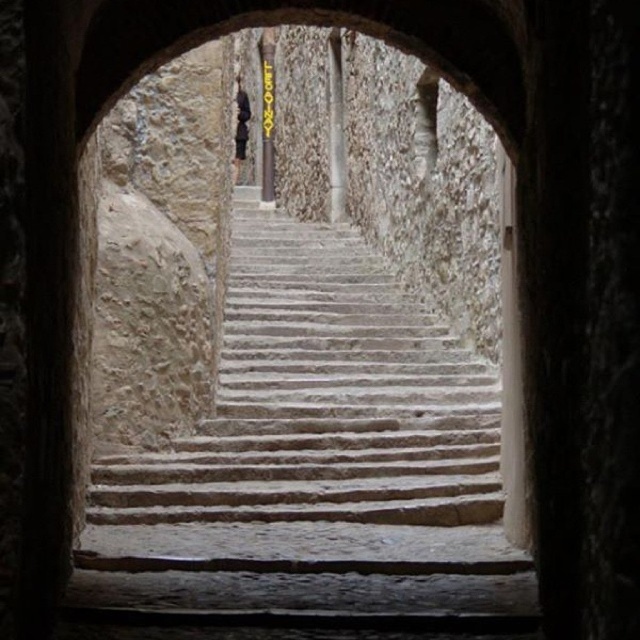
Which of these two, white stone stairs at center or dark fabric figure at center, stands taller?

dark fabric figure at center is taller.

Which is below, white stone stairs at center or dark fabric figure at center?

white stone stairs at center is lower down.

Identify the location of white stone stairs at center. Image resolution: width=640 pixels, height=640 pixels. (317, 424).

Locate an element on the screen. This screenshot has height=640, width=640. white stone stairs at center is located at coordinates (317, 424).